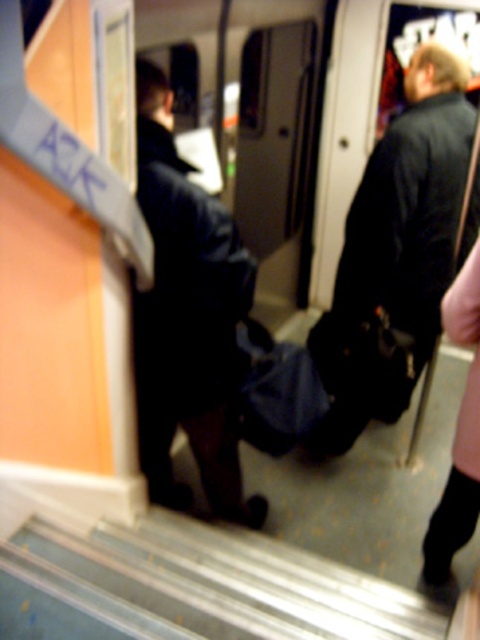
Question: Which point appears closest to the camera in this image?

Choices:
 (A) (440, 93)
 (B) (9, 632)
 (C) (240, 484)

Answer: (B)

Question: Is black leather jacket at center behind black leather jacket at right?

Choices:
 (A) no
 (B) yes

Answer: (A)

Question: Where is metallic gray stairs at lower center located in relation to black leather jacket at center in the image?

Choices:
 (A) left
 (B) right

Answer: (B)

Question: Is black leather jacket at center closer to camera compared to black leather jacket at right?

Choices:
 (A) yes
 (B) no

Answer: (A)

Question: Which of the following is the farthest from the observer?

Choices:
 (A) (201, 628)
 (B) (400, 140)

Answer: (B)

Question: Estimate the real-world distances between objects in this image. Which object is farther from the metallic gray stairs at lower center?

Choices:
 (A) black leather jacket at center
 (B) black leather jacket at right

Answer: (B)